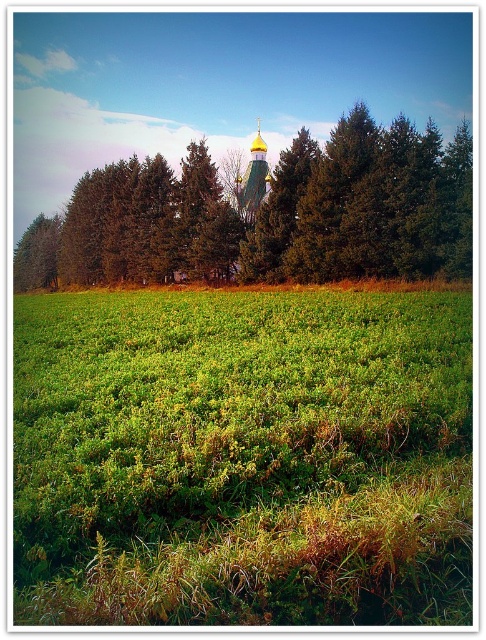
You are a gardener planning to plant a new flower bed in the green grassy field at center and the green leafy tree at center. Which area would you choose if you want to ensure the flowers have more space to spread their roots?

The green leafy tree at center has more space for the flowers to spread their roots because it is thicker than the green grassy field at center.

You are standing at the point marked as point (240,456) in the image. Looking around, you see a green grassy field at center and the tall evergreen trees in the midground. Which direction should you walk to reach the tall evergreen trees?

The point (240,456) corresponds to the green grassy field at center. To reach the tall evergreen trees in the midground, you should walk forward towards them since they are positioned behind the field in the scene.